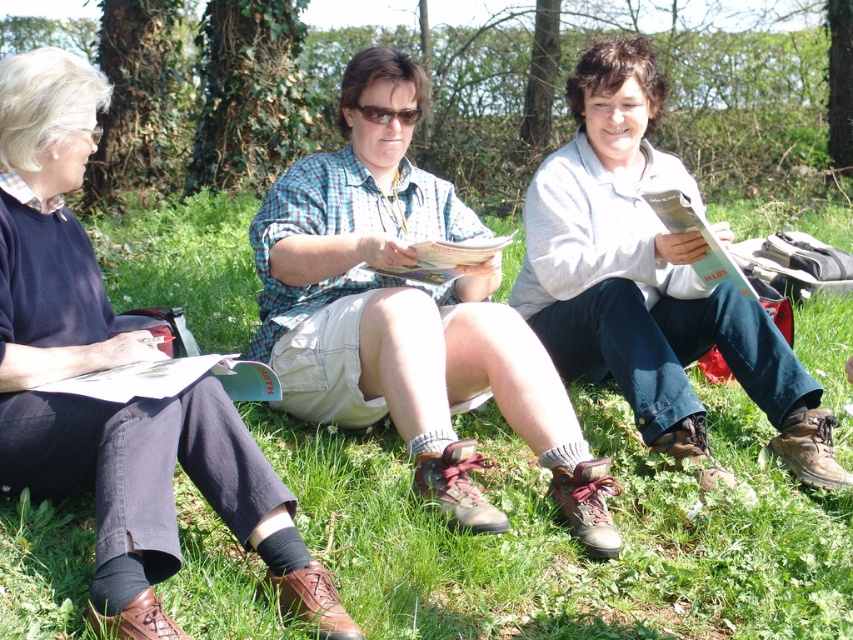
Question: Considering the real-world distances, which object is farthest from the green grass at center?

Choices:
 (A) checkered fabric shirt at center
 (B) light gray fleece jacket at center

Answer: (B)

Question: Which object is the farthest from the light gray fleece jacket at center?

Choices:
 (A) green grass at center
 (B) matte blue shirt at center

Answer: (B)

Question: Which is farther from the matte blue shirt at center?

Choices:
 (A) light gray fleece jacket at center
 (B) checkered fabric shirt at center
 (C) green grass at center

Answer: (A)

Question: Does matte blue shirt at center have a greater width compared to light gray fleece jacket at center?

Choices:
 (A) no
 (B) yes

Answer: (A)

Question: Does green grass at center have a greater width compared to matte blue shirt at center?

Choices:
 (A) no
 (B) yes

Answer: (B)

Question: Does matte blue shirt at center have a smaller size compared to light gray fleece jacket at center?

Choices:
 (A) yes
 (B) no

Answer: (A)